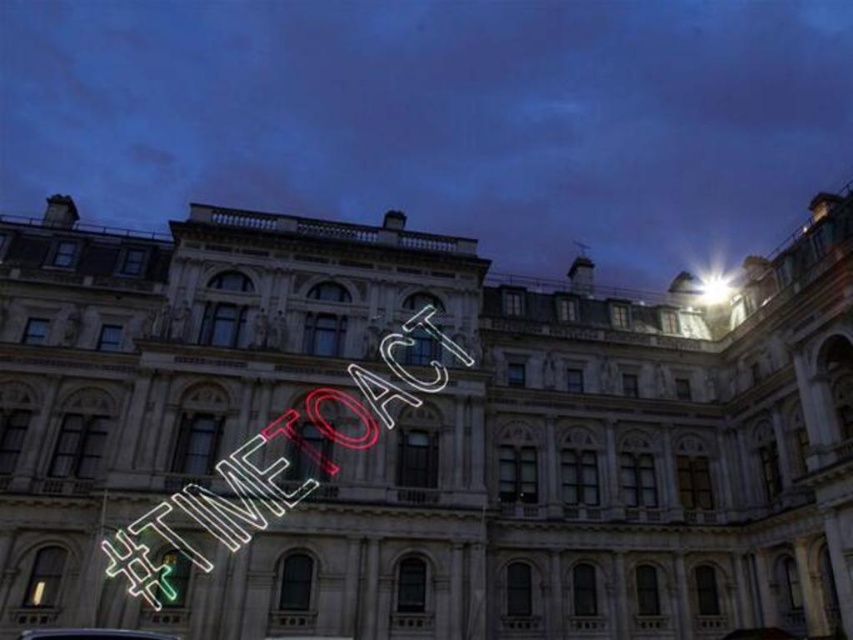
Does neon sign at center have a larger size compared to shiny silver car at lower center?

Correct, neon sign at center is larger in size than shiny silver car at lower center.

Who is positioned more to the right, neon sign at center or shiny silver car at lower center?

From the viewer's perspective, neon sign at center appears more on the right side.

Which is behind, point (251, 536) or point (109, 634)?

The point (251, 536) is behind.

In order to click on neon sign at center in this screenshot , I will do `click(274, 465)`.